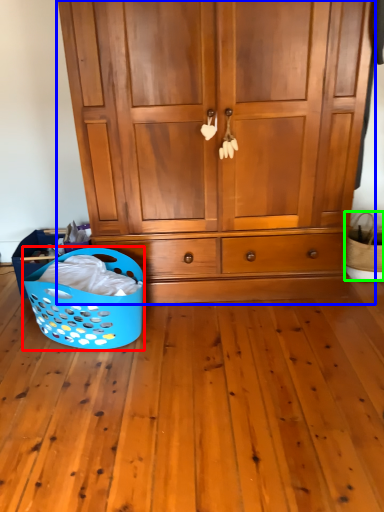
Question: Estimate the real-world distances between objects in this image. Which object is farther from basket (highlighted by a red box), cupboard (highlighted by a blue box) or basket (highlighted by a green box)?

Choices:
 (A) cupboard
 (B) basket

Answer: (B)